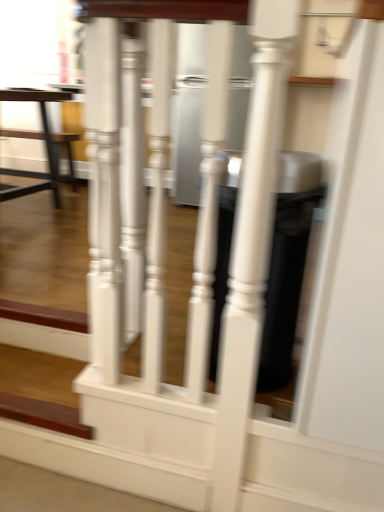
At what (x,y) coordinates should I click in order to perform the action: click on wooden table at left. Please return your answer as a coordinate pair (x, y). Image resolution: width=384 pixels, height=512 pixels. Looking at the image, I should click on (33, 138).

This screenshot has width=384, height=512. What do you see at coordinates (33, 138) in the screenshot? I see `wooden table at left` at bounding box center [33, 138].

Find the location of a particular element. wooden table at left is located at coordinates (33, 138).